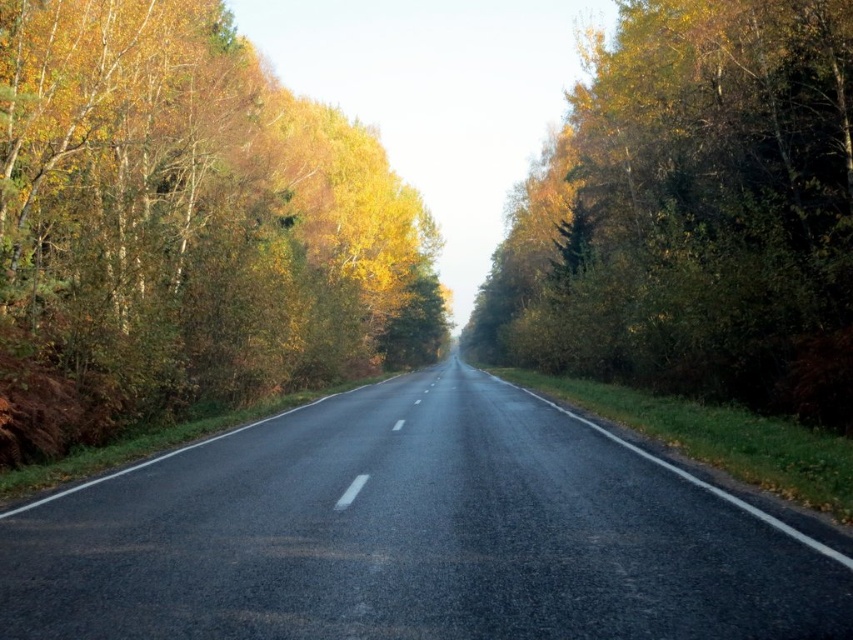
You are driving a car that is 5 meters long. You see the black asphalt highway at center and the green leafy tree at right. Can your car fit between them without touching either?

The distance between the black asphalt highway at center and the green leafy tree at right is 25.35 meters. Since your car is only 5 meters long, it can easily fit between them without touching either.